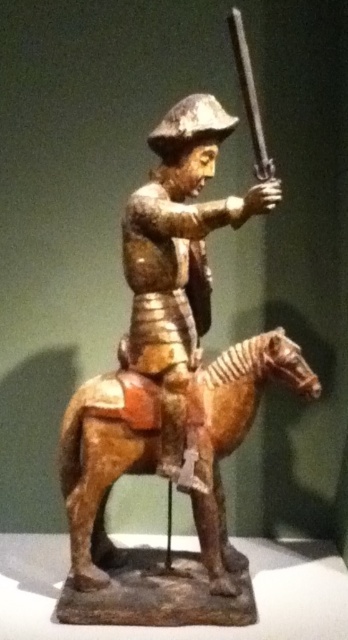
Does wooden horse at center have a greater height compared to wooden figure at center?

No, wooden horse at center is not taller than wooden figure at center.

Where is `wooden horse at center`? The height and width of the screenshot is (640, 348). wooden horse at center is located at coordinates (104, 460).

Which is in front, point (139, 467) or point (223, 220)?

Positioned in front is point (223, 220).

You are a GUI agent. You are given a task and a screenshot of the screen. Output one action in this format:
    pyautogui.click(x=<x>, y=<y>)
    Task: Click on the wooden horse at center
    This screenshot has width=348, height=640.
    Given the screenshot: What is the action you would take?
    pyautogui.click(x=104, y=460)

Does point (198, 444) come in front of point (262, 156)?

That is False.

You are a GUI agent. You are given a task and a screenshot of the screen. Output one action in this format:
    pyautogui.click(x=<x>, y=<y>)
    Task: Click on the wooden horse at center
    Image resolution: width=348 pixels, height=640 pixels.
    Given the screenshot: What is the action you would take?
    (x=104, y=460)

Looking at this image, can you confirm if wooden figure at center is positioned above polished metal rifle at upper center?

No, wooden figure at center is not above polished metal rifle at upper center.

Is point (135, 240) closer to viewer compared to point (228, 29)?

Yes.

Identify the location of wooden figure at center. (178, 253).